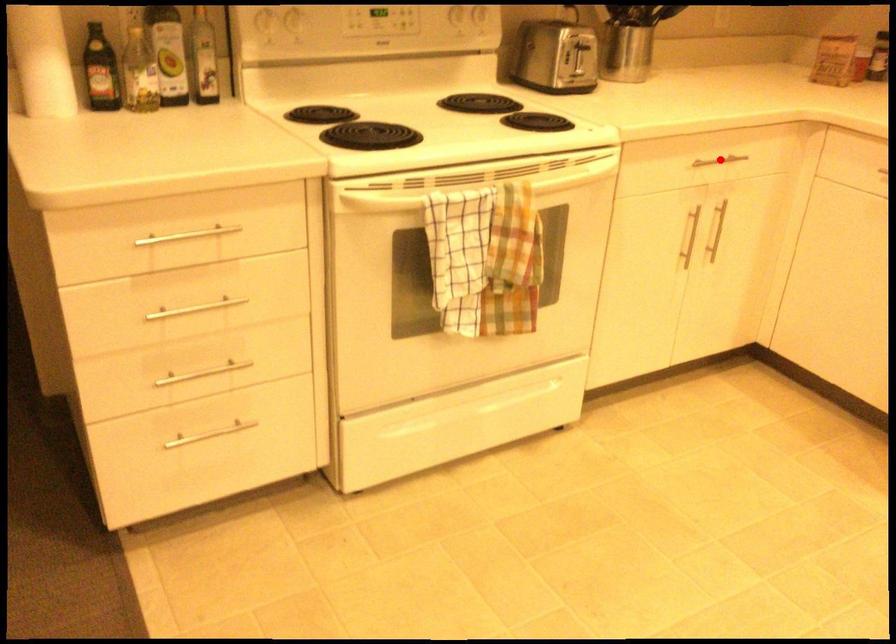
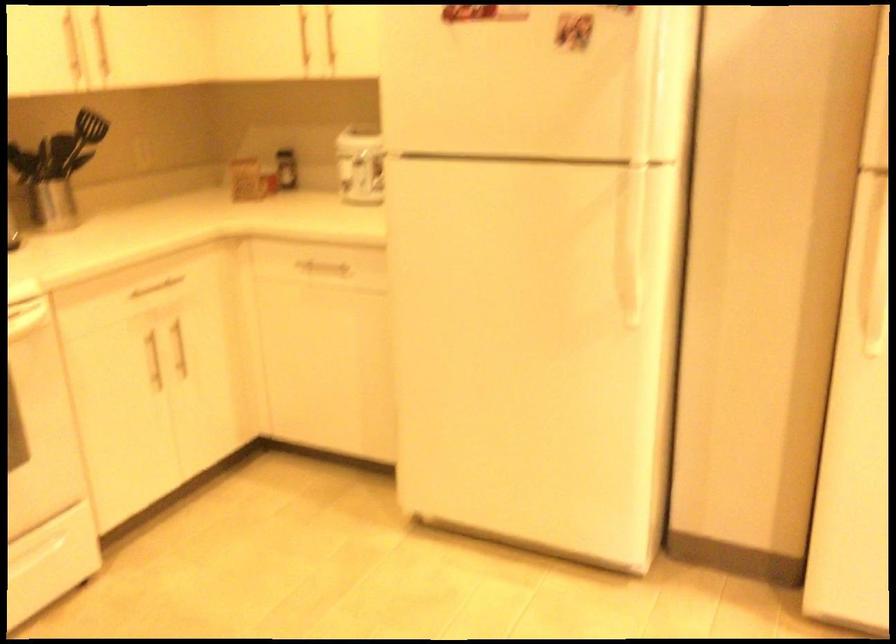
Where in the second image is the point corresponding to the highlighted location from the first image?

(159, 283)